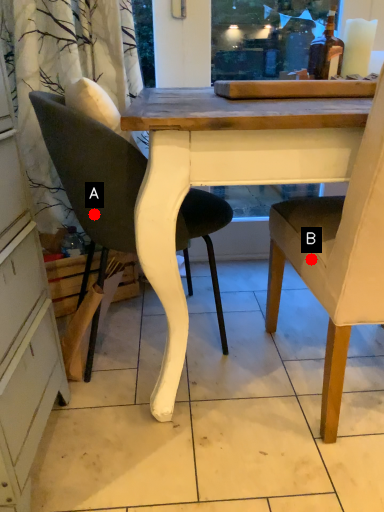
Question: Two points are circled on the image, labeled by A and B beside each circle. Which point is farther from the camera taking this photo?

Choices:
 (A) A is further
 (B) B is further

Answer: (A)